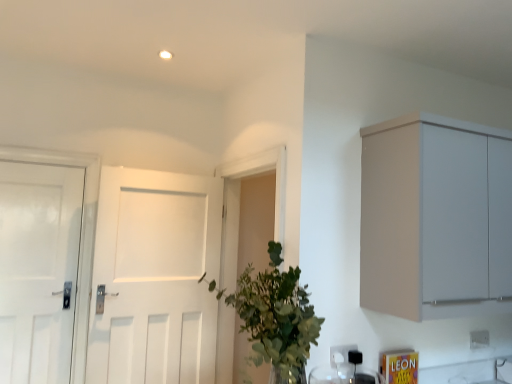
How much space does white matte door at center, which ranks as the second door in left-to-right order, occupy vertically?

1.32 meters.

Where is `white matte door at center, the first door when ordered from right to left`? Image resolution: width=512 pixels, height=384 pixels. white matte door at center, the first door when ordered from right to left is located at coordinates (155, 278).

The height and width of the screenshot is (384, 512). What do you see at coordinates (275, 317) in the screenshot?
I see `green leafy plant at center` at bounding box center [275, 317].

I want to click on white plastic electric outlet at lower center, positioned as the first electric outlet in left-to-right order, so click(x=340, y=354).

Find the location of a particular element. The image size is (512, 384). white matte door at left, which appears as the second door when viewed from the right is located at coordinates (38, 269).

In order to face white matte door at left, which appears as the second door when viewed from the right, should I rotate leftwards or rightwards?

A 27.313 degree turn to the left will do.

Describe the element at coordinates (479, 339) in the screenshot. The height and width of the screenshot is (384, 512). I see `white plastic electric outlet at lower right, the 2th electric outlet positioned from the left` at that location.

Find the location of a particular element. white matte door at center, which ranks as the second door in left-to-right order is located at coordinates (155, 278).

Is green leafy plant at center completely or partially inside white plastic electric outlet at lower right, the 2th electric outlet positioned from the left?

Definitely not — green leafy plant at center is not inside white plastic electric outlet at lower right, the 2th electric outlet positioned from the left.

In the scene shown: From a real-world perspective, is white plastic electric outlet at lower right, the 1th electric outlet in the back-to-front sequence, above or below green leafy plant at center?

white plastic electric outlet at lower right, the 1th electric outlet in the back-to-front sequence, is below green leafy plant at center.

Is white plastic electric outlet at lower right, the 1th electric outlet in the back-to-front sequence, facing away from green leafy plant at center?

No, green leafy plant at center is not at the back of white plastic electric outlet at lower right, the 1th electric outlet in the back-to-front sequence.

Is white plastic electric outlet at lower right, the 1th electric outlet in the back-to-front sequence, bigger than white matte door at left, which appears as the second door when viewed from the right?

No, white plastic electric outlet at lower right, the 1th electric outlet in the back-to-front sequence, is not bigger than white matte door at left, which appears as the second door when viewed from the right.

How far apart are white plastic electric outlet at lower right, which is counted as the first electric outlet, starting from the right, and white matte door at left, which appears as the second door when viewed from the right?

white plastic electric outlet at lower right, which is counted as the first electric outlet, starting from the right, and white matte door at left, which appears as the second door when viewed from the right, are 2.39 meters apart.

Is white plastic electric outlet at lower right, the 2th electric outlet positioned from the left, turned away from white matte door at left, which appears as the second door when viewed from the right?

That's not correct — white plastic electric outlet at lower right, the 2th electric outlet positioned from the left, is not looking away from white matte door at left, which appears as the second door when viewed from the right.

Would you consider white plastic electric outlet at lower right, the 2th electric outlet positioned from the left, to be distant from white matte door at left, which appears as the second door when viewed from the right?

That's right, there is a large distance between white plastic electric outlet at lower right, the 2th electric outlet positioned from the left, and white matte door at left, which appears as the second door when viewed from the right.

Looking at this image, is matte gray cabinet at upper right situated inside white plastic electric outlet at lower center, the second electric outlet when ordered from right to left, or outside?

matte gray cabinet at upper right is not enclosed by white plastic electric outlet at lower center, the second electric outlet when ordered from right to left.

At what (x,y) coordinates should I click in order to perform the action: click on electric outlet that is the 2nd object directly below the matte gray cabinet at upper right (from a real-world perspective). Please return your answer as a coordinate pair (x, y). This screenshot has height=384, width=512. Looking at the image, I should click on (340, 354).

Does matte gray cabinet at upper right have a lesser height compared to white plastic electric outlet at lower center, which is the 1th electric outlet from front to back?

No.

Considering the relative sizes of matte gray cabinet at upper right and white plastic electric outlet at lower center, positioned as the first electric outlet in left-to-right order, in the image provided, is matte gray cabinet at upper right wider than white plastic electric outlet at lower center, positioned as the first electric outlet in left-to-right order,?

Correct, the width of matte gray cabinet at upper right exceeds that of white plastic electric outlet at lower center, positioned as the first electric outlet in left-to-right order.

Considering the sizes of objects white matte door at center, the first door when ordered from right to left, and white plastic electric outlet at lower center, the second electric outlet when ordered from right to left, in the image provided, who is thinner, white matte door at center, the first door when ordered from right to left, or white plastic electric outlet at lower center, the second electric outlet when ordered from right to left,?

white plastic electric outlet at lower center, the second electric outlet when ordered from right to left, is thinner.

Is white matte door at center, which ranks as the second door in left-to-right order, positioned far away from white plastic electric outlet at lower center, the second electric outlet when ordered from right to left?

Yes, white matte door at center, which ranks as the second door in left-to-right order, and white plastic electric outlet at lower center, the second electric outlet when ordered from right to left, are located far from each other.

Considering the relative positions of white matte door at center, which ranks as the second door in left-to-right order, and white plastic electric outlet at lower center, which is the 1th electric outlet from front to back, in the image provided, is white matte door at center, which ranks as the second door in left-to-right order, in front of white plastic electric outlet at lower center, which is the 1th electric outlet from front to back,?

No, it is not.

Between white plastic electric outlet at lower right, which is counted as the first electric outlet, starting from the right, and white plastic electric outlet at lower center, the second electric outlet when ordered from right to left, which one is positioned in front?

white plastic electric outlet at lower center, the second electric outlet when ordered from right to left, is closer to the camera.

In the image, there is a white plastic electric outlet at lower right, the 1th electric outlet in the back-to-front sequence. Where is `electric outlet below it (from a real-world perspective)`? This screenshot has height=384, width=512. electric outlet below it (from a real-world perspective) is located at coordinates pos(340,354).

From the picture: Is white plastic electric outlet at lower center, the 2th electric outlet from the back, a part of white plastic electric outlet at lower right, the 1th electric outlet in the back-to-front sequence?

No, white plastic electric outlet at lower center, the 2th electric outlet from the back, is not inside white plastic electric outlet at lower right, the 1th electric outlet in the back-to-front sequence.

Is white plastic electric outlet at lower right, marked as the second electric outlet in a front-to-back arrangement, far away from white plastic electric outlet at lower center, which is the 1th electric outlet from front to back?

No, white plastic electric outlet at lower right, marked as the second electric outlet in a front-to-back arrangement, is not far from white plastic electric outlet at lower center, which is the 1th electric outlet from front to back.

Can you confirm if matte gray cabinet at upper right is bigger than green leafy plant at center?

Yes.

You are a GUI agent. You are given a task and a screenshot of the screen. Output one action in this format:
    pyautogui.click(x=<x>, y=<y>)
    Task: Click on the houseplant below the matte gray cabinet at upper right (from the image's perspective)
    
    Given the screenshot: What is the action you would take?
    pyautogui.click(x=275, y=317)

Based on the photo, does matte gray cabinet at upper right have a lesser width compared to green leafy plant at center?

No.

From the image's perspective, is matte gray cabinet at upper right above or below green leafy plant at center?

From the image's perspective, matte gray cabinet at upper right appears above green leafy plant at center.

Which door is the 2nd one when counting from the left side of the white plastic electric outlet at lower right, which is counted as the first electric outlet, starting from the right? Please provide its 2D coordinates.

[(38, 269)]

Can you confirm if white matte door at left, which ranks as the first door in left-to-right order, is thinner than white plastic electric outlet at lower right, which is counted as the first electric outlet, starting from the right?

No, white matte door at left, which ranks as the first door in left-to-right order, is not thinner than white plastic electric outlet at lower right, which is counted as the first electric outlet, starting from the right.

Considering the sizes of white matte door at left, which ranks as the first door in left-to-right order, and white plastic electric outlet at lower right, marked as the second electric outlet in a front-to-back arrangement, in the image, is white matte door at left, which ranks as the first door in left-to-right order, taller or shorter than white plastic electric outlet at lower right, marked as the second electric outlet in a front-to-back arrangement,?

Considering their sizes, white matte door at left, which ranks as the first door in left-to-right order, has more height than white plastic electric outlet at lower right, marked as the second electric outlet in a front-to-back arrangement.

Is white matte door at left, which ranks as the first door in left-to-right order, inside or outside of white plastic electric outlet at lower right, which is counted as the first electric outlet, starting from the right?

white matte door at left, which ranks as the first door in left-to-right order, is not enclosed by white plastic electric outlet at lower right, which is counted as the first electric outlet, starting from the right.

The image size is (512, 384). What are the coordinates of `houseplant in front of the white plastic electric outlet at lower right, which is counted as the first electric outlet, starting from the right` in the screenshot? It's located at (275, 317).

From the image's perspective, which electric outlet is the 2nd one below the white matte door at left, which appears as the second door when viewed from the right? Please provide its 2D coordinates.

[(479, 339)]

Based on their spatial positions, is white plastic electric outlet at lower center, which is the 1th electric outlet from front to back, or white matte door at left, which ranks as the first door in left-to-right order, further from white plastic electric outlet at lower right, the 1th electric outlet in the back-to-front sequence?

Among the two, white matte door at left, which ranks as the first door in left-to-right order, is located further to white plastic electric outlet at lower right, the 1th electric outlet in the back-to-front sequence.

Considering their positions, is white plastic electric outlet at lower right, the 2th electric outlet positioned from the left, positioned closer to white matte door at center, which ranks as the second door in left-to-right order, than white matte door at left, which appears as the second door when viewed from the right?

Based on the image, white matte door at left, which appears as the second door when viewed from the right, appears to be nearer to white matte door at center, which ranks as the second door in left-to-right order.

Considering their positions, is white plastic electric outlet at lower right, the 2th electric outlet positioned from the left, positioned further to matte gray cabinet at upper right than green leafy plant at center?

The object further to matte gray cabinet at upper right is white plastic electric outlet at lower right, the 2th electric outlet positioned from the left.

Which object lies further to the anchor point matte gray cabinet at upper right, white matte door at left, which appears as the second door when viewed from the right, or white plastic electric outlet at lower right, the 2th electric outlet positioned from the left?

white matte door at left, which appears as the second door when viewed from the right, lies further to matte gray cabinet at upper right than the other object.

When comparing their distances from matte gray cabinet at upper right, does white matte door at center, the first door when ordered from right to left, or green leafy plant at center seem closer?

The object closer to matte gray cabinet at upper right is green leafy plant at center.

Considering their positions, is white plastic electric outlet at lower center, which is the 1th electric outlet from front to back, positioned further to white matte door at center, the first door when ordered from right to left, than white matte door at left, which ranks as the first door in left-to-right order?

white plastic electric outlet at lower center, which is the 1th electric outlet from front to back, lies further to white matte door at center, the first door when ordered from right to left, than the other object.

Based on their spatial positions, is white plastic electric outlet at lower center, the 2th electric outlet from the back, or matte gray cabinet at upper right further from green leafy plant at center?

Based on the image, matte gray cabinet at upper right appears to be further to green leafy plant at center.

Based on the photo, which object lies further to the anchor point matte gray cabinet at upper right, white matte door at center, which ranks as the second door in left-to-right order, or white matte door at left, which ranks as the first door in left-to-right order?

The object further to matte gray cabinet at upper right is white matte door at left, which ranks as the first door in left-to-right order.

The height and width of the screenshot is (384, 512). Find the location of `cabinetry between white matte door at center, the first door when ordered from right to left, and white plastic electric outlet at lower right, marked as the second electric outlet in a front-to-back arrangement`. cabinetry between white matte door at center, the first door when ordered from right to left, and white plastic electric outlet at lower right, marked as the second electric outlet in a front-to-back arrangement is located at coordinates (436, 218).

Locate an element on the screen. Image resolution: width=512 pixels, height=384 pixels. door situated between white matte door at left, which appears as the second door when viewed from the right, and white plastic electric outlet at lower right, the 1th electric outlet in the back-to-front sequence, from left to right is located at coordinates (155, 278).

In order to click on door between white matte door at left, which appears as the second door when viewed from the right, and matte gray cabinet at upper right in this screenshot , I will do `click(155, 278)`.

Locate an element on the screen. This screenshot has height=384, width=512. houseplant located between white matte door at center, which ranks as the second door in left-to-right order, and matte gray cabinet at upper right in the left-right direction is located at coordinates (275, 317).